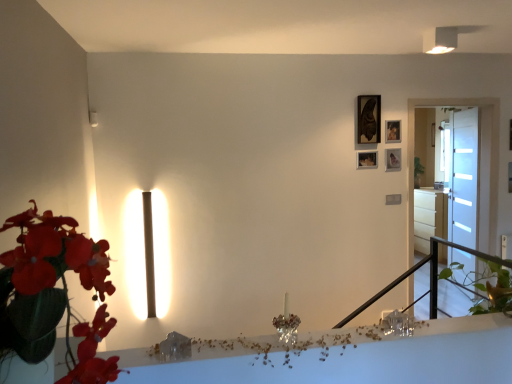
Question: Can you confirm if clear glass table at center, the 1th table ordered from the bottom, is smaller than matte black picture frame at upper right, the fourth picture frame when ordered from bottom to top?

Choices:
 (A) no
 (B) yes

Answer: (A)

Question: Is matte black picture frame at upper right, which is the 1th picture frame in top-to-bottom order, surrounded by clear glass table at center, the 1th table ordered from the bottom?

Choices:
 (A) yes
 (B) no

Answer: (B)

Question: Considering the relative sizes of clear glass table at center, the 1th table ordered from the bottom, and matte black picture frame at upper right, the fourth picture frame when ordered from bottom to top, in the image provided, is clear glass table at center, the 1th table ordered from the bottom, shorter than matte black picture frame at upper right, the fourth picture frame when ordered from bottom to top,?

Choices:
 (A) yes
 (B) no

Answer: (A)

Question: Considering the relative sizes of clear glass table at center, the second table in the top-to-bottom sequence, and matte black picture frame at upper right, the fourth picture frame when ordered from bottom to top, in the image provided, is clear glass table at center, the second table in the top-to-bottom sequence, taller than matte black picture frame at upper right, the fourth picture frame when ordered from bottom to top,?

Choices:
 (A) yes
 (B) no

Answer: (B)

Question: From a real-world perspective, is clear glass table at center, which is the second table in back-to-front order, physically below matte black picture frame at upper right, which is the 1th picture frame in top-to-bottom order?

Choices:
 (A) no
 (B) yes

Answer: (B)

Question: From a real-world perspective, does clear glass table at center, which is the second table in back-to-front order, stand above matte black picture frame at upper right, which is the 1th picture frame in top-to-bottom order?

Choices:
 (A) yes
 (B) no

Answer: (B)

Question: Is leather-like green plant at left placed right next to clear glass table at center, the second table in the top-to-bottom sequence?

Choices:
 (A) yes
 (B) no

Answer: (B)

Question: Would you say leather-like green plant at left contains clear glass table at center, which is the 2th table from right to left?

Choices:
 (A) no
 (B) yes

Answer: (A)

Question: Is leather-like green plant at left far from clear glass table at center, which is the 2th table from right to left?

Choices:
 (A) no
 (B) yes

Answer: (B)

Question: Is leather-like green plant at left at the left side of clear glass table at center, the 1th table ordered from the bottom?

Choices:
 (A) no
 (B) yes

Answer: (B)

Question: Does leather-like green plant at left have a greater height compared to clear glass table at center, which is the 2th table from right to left?

Choices:
 (A) yes
 (B) no

Answer: (A)

Question: From a real-world perspective, does leather-like green plant at left stand above clear glass table at center, which is the 2th table from right to left?

Choices:
 (A) yes
 (B) no

Answer: (A)

Question: From the image's perspective, does crystal glass candle at center appear lower than white glossy drawer at right, the 1th table in the right-to-left sequence?

Choices:
 (A) yes
 (B) no

Answer: (A)